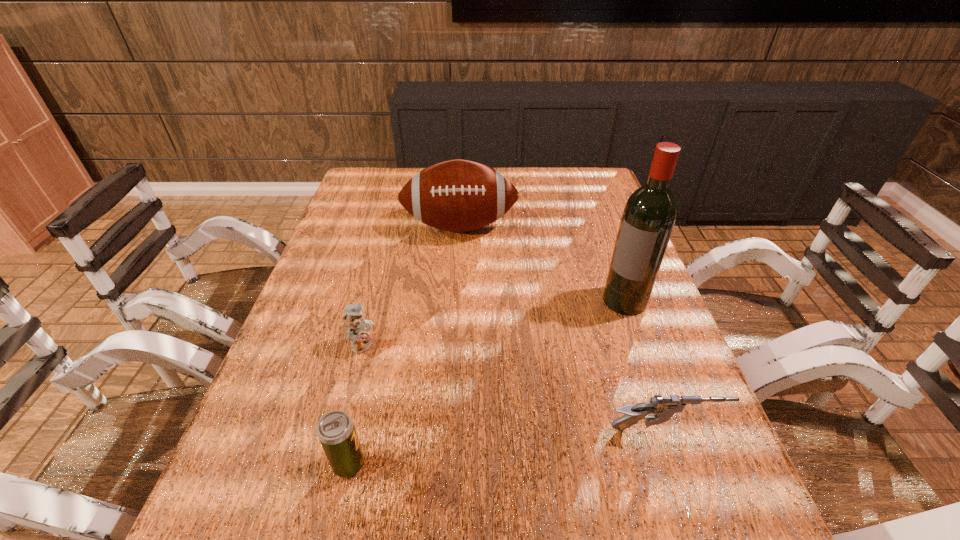
I want to click on vacant space situated 0.100m on the label of the tallest object, so click(x=595, y=336).

The image size is (960, 540). I want to click on free space located 0.220m on the laces of the farthest object, so click(x=463, y=299).

Locate an element on the screen. vacant space positioned on the laces of the farthest object is located at coordinates (463, 294).

The height and width of the screenshot is (540, 960). In order to click on free region located 0.050m on the laces of the farthest object in this screenshot , I will do `click(462, 258)`.

Locate an element on the screen. vacant space located 0.200m on the front-facing side of the third farthest object is located at coordinates (447, 388).

Where is `free space located on the front-facing side of the third farthest object`? This screenshot has width=960, height=540. free space located on the front-facing side of the third farthest object is located at coordinates (391, 360).

The height and width of the screenshot is (540, 960). Find the location of `vacant space situated 0.230m on the front-facing side of the third farthest object`. vacant space situated 0.230m on the front-facing side of the third farthest object is located at coordinates (460, 394).

I want to click on object located in the near edge section of the desktop, so click(336, 431).

Locate an element on the screen. This screenshot has height=540, width=960. object that is at the left edge is located at coordinates (358, 328).

This screenshot has height=540, width=960. Identify the location of gun at the right edge. (663, 408).